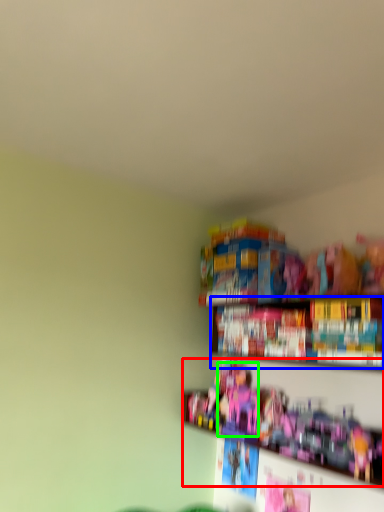
Question: Which is farther away from toy (highlighted by a red box)? book (highlighted by a blue box) or toy (highlighted by a green box)?

Choices:
 (A) book
 (B) toy

Answer: (A)